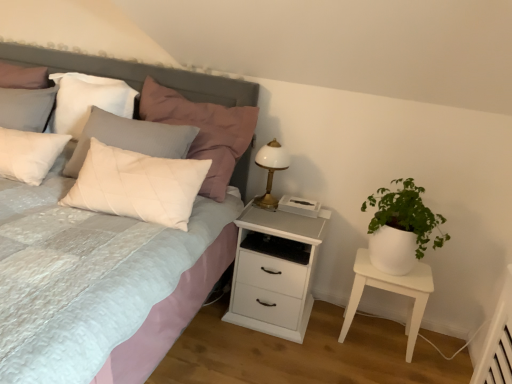
What are the coordinates of `vacant area that is in front of white matte table at right` in the screenshot? It's located at (379, 369).